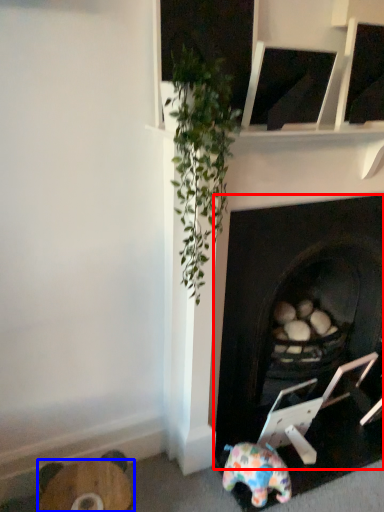
Question: Among these objects, which one is nearest to the camera, fireplace (highlighted by a red box) or furniture (highlighted by a blue box)?

Choices:
 (A) fireplace
 (B) furniture

Answer: (A)